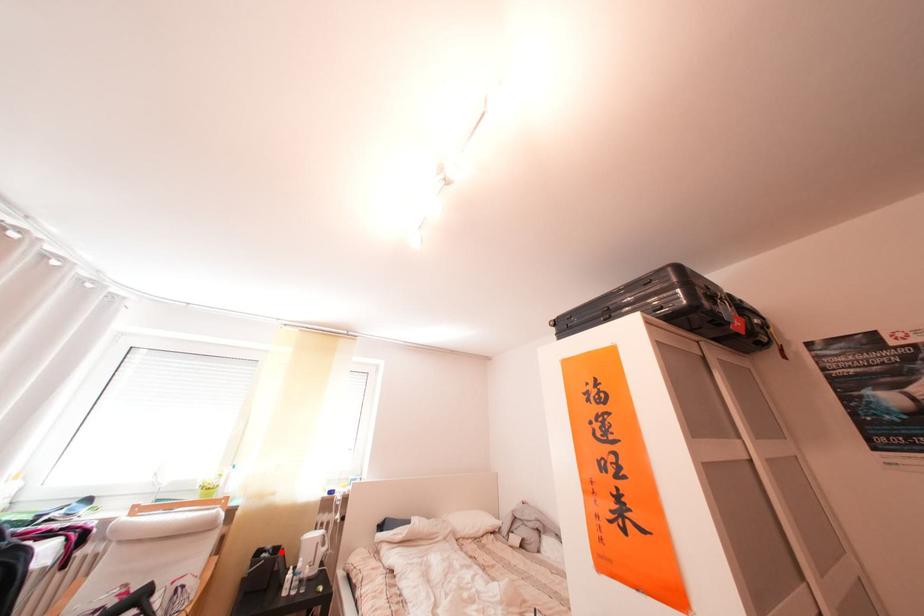
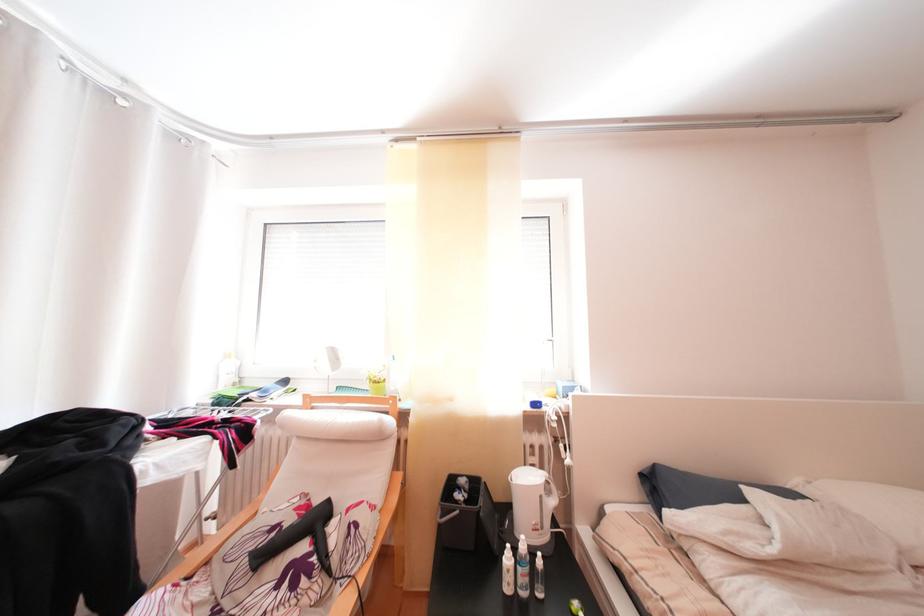
Find the pixel in the second image that matches the highlighted location in the first image.

(475, 487)